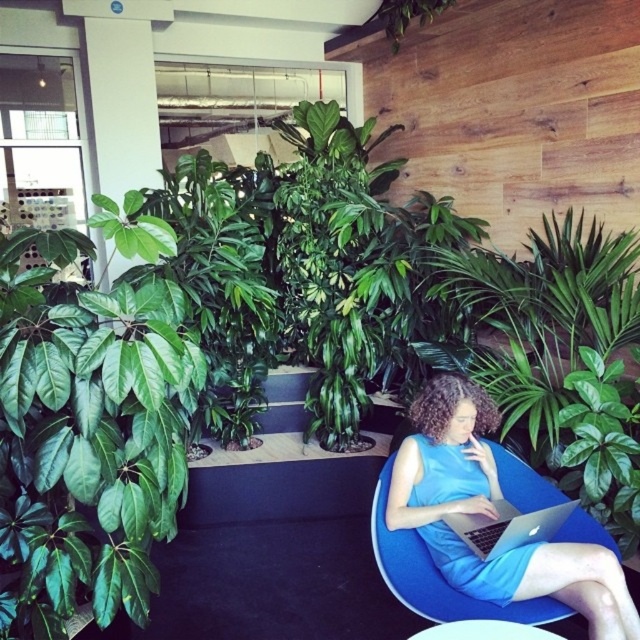
You are a visitor in this office space and want to move from the entrance to the blue fabric chair at lower right. There is a green leafy plant at left blocking your path. Can you walk around it to reach the chair?

→ The green leafy plant at left is to the left of the blue fabric chair at lower right, so you can walk around the green leafy plant at left to reach the blue fabric chair at lower right.

You are a photographer standing at the camera position. You want to take a photo of the green leafy plant at left without moving the camera. Is the plant within the camera range of 6 feet?

The green leafy plant at left and camera are 5.94 feet apart, so yes, the plant is within the camera range of 6 feet.

You are a visitor entering the office and want to sit down on the blue fabric chair at lower right. To reach it, you must walk around the silver metallic laptop at center. Which direction should you walk around the laptop to face the chair?

The blue fabric chair at lower right is positioned on the left side of the silver metallic laptop at center. To face the chair, you should walk around the laptop to your left, which would place the chair in front of you.